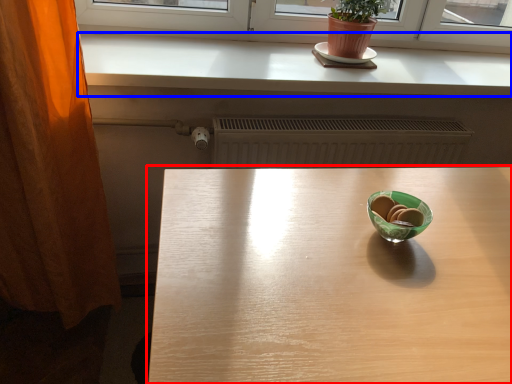
Question: Among these objects, which one is farthest to the camera, table (highlighted by a red box) or counter top (highlighted by a blue box)?

Choices:
 (A) table
 (B) counter top

Answer: (B)